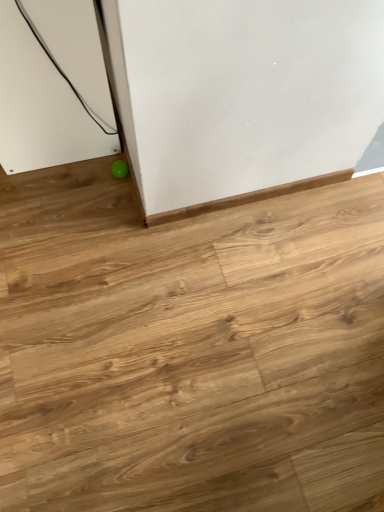
Locate an element on the screen. The image size is (384, 512). free space on the front side of green rubber ball at lower left is located at coordinates (110, 213).